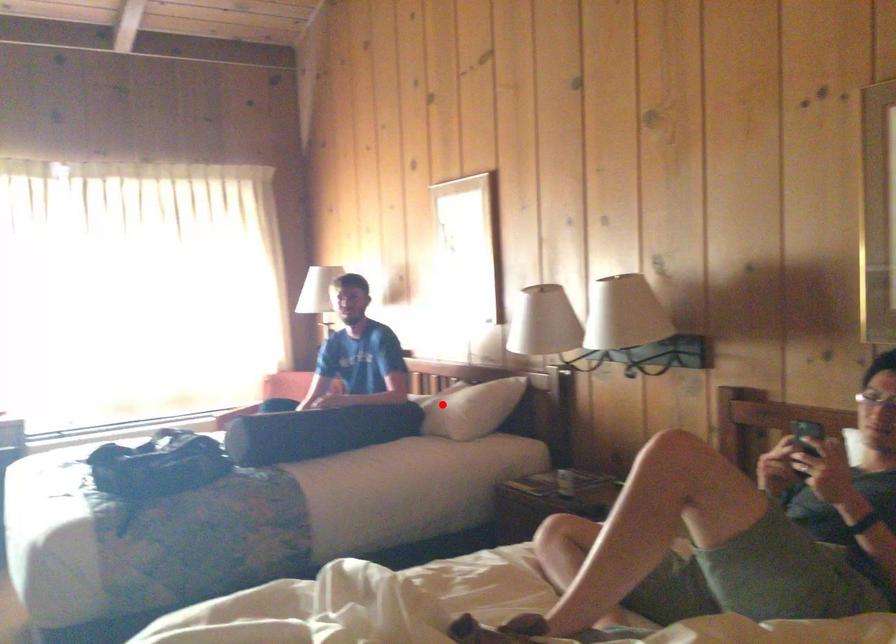
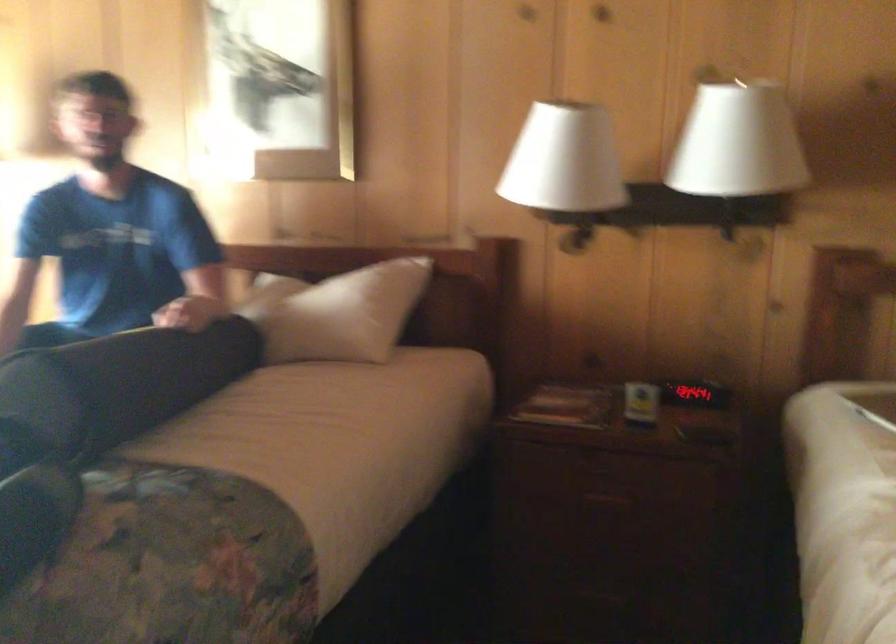
The point at the highlighted location is marked in the first image. Where is the corresponding point in the second image?

(340, 313)